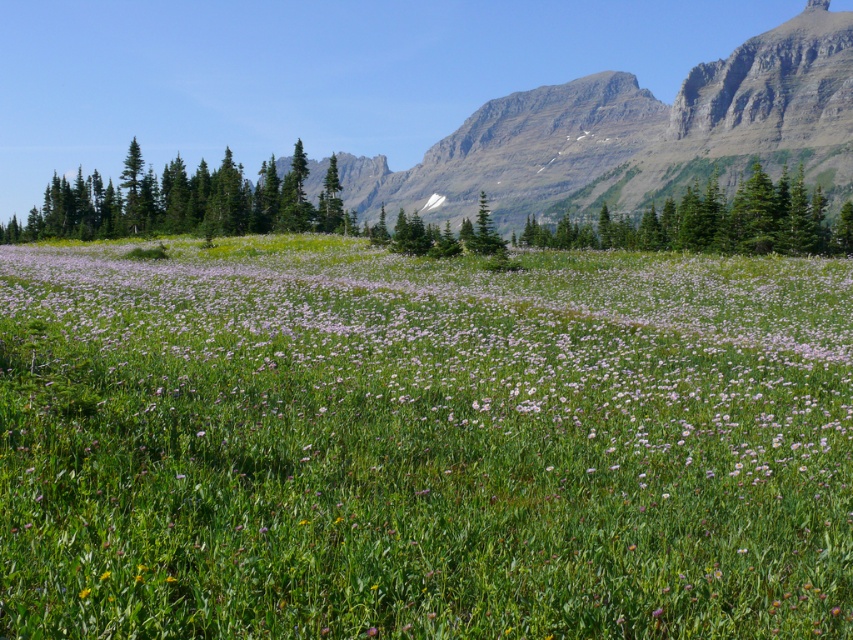
Question: Which point appears closest to the camera in this image?

Choices:
 (A) (680, 234)
 (B) (334, 209)

Answer: (A)

Question: Does green matte trees at left have a greater width compared to green textured pine tree at center?

Choices:
 (A) yes
 (B) no

Answer: (B)

Question: Which of the following is the farthest from the observer?

Choices:
 (A) green textured pine tree at center
 (B) green matte trees at left
 (C) green matte tree at center
 (D) pink soft grass at center

Answer: (C)

Question: Does green matte trees at left come behind green textured pine tree at center?

Choices:
 (A) yes
 (B) no

Answer: (A)

Question: Which object appears farthest from the camera in this image?

Choices:
 (A) green matte tree at center
 (B) pink soft grass at center
 (C) green textured pine tree at center
 (D) green matte trees at left

Answer: (A)

Question: Is pink soft grass at center wider than green textured pine tree at center?

Choices:
 (A) no
 (B) yes

Answer: (A)